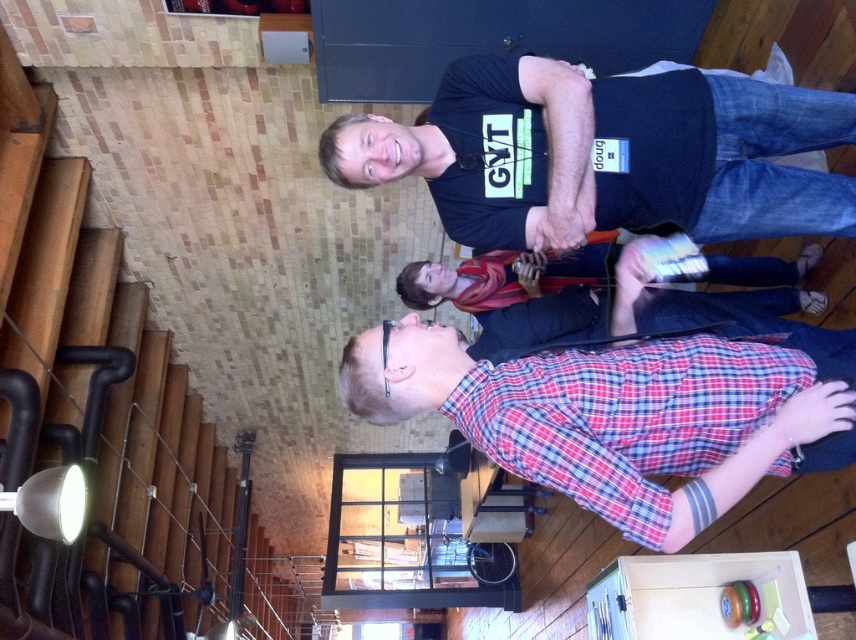
Question: Which of the following is the farthest from the observer?

Choices:
 (A) red plaid shirt at center
 (B) matte red scarf at center
 (C) black cotton t-shirt at upper center
 (D) wooden stairs at lower left

Answer: (D)

Question: Is the position of red plaid shirt at center less distant than that of matte red scarf at center?

Choices:
 (A) no
 (B) yes

Answer: (B)

Question: Is black cotton t-shirt at upper center closer to the viewer compared to matte red scarf at center?

Choices:
 (A) no
 (B) yes

Answer: (B)

Question: Is wooden stairs at lower left closer to the viewer compared to black cotton t-shirt at upper center?

Choices:
 (A) yes
 (B) no

Answer: (B)

Question: Which point is farther from the camera taking this photo?

Choices:
 (A) (715, 147)
 (B) (724, 268)

Answer: (B)

Question: Which object appears closest to the camera in this image?

Choices:
 (A) matte red scarf at center
 (B) red plaid shirt at center
 (C) wooden stairs at lower left
 (D) black cotton t-shirt at upper center

Answer: (B)